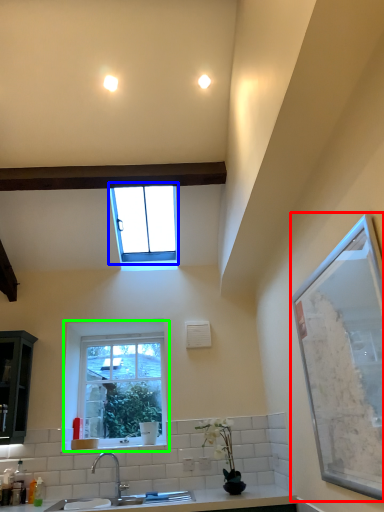
Question: Estimate the real-world distances between objects in this image. Which object is farther from window screen (highlighted by a red box), window (highlighted by a blue box) or window (highlighted by a green box)?

Choices:
 (A) window
 (B) window

Answer: (A)